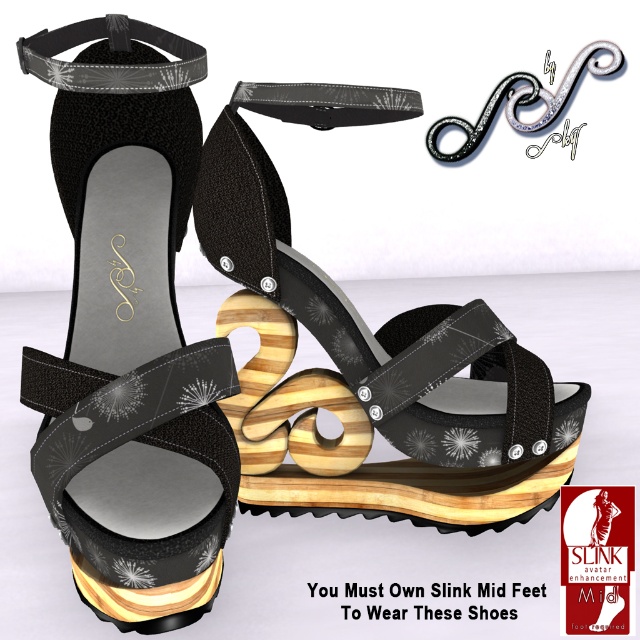
You are standing in a room with a wooden platform sandal at center. If you want to place a small vase exactly where the sandal is, where should you place it?

You should place the small vase at the position where the wooden platform sandal at center is located, which is at point (x=380, y=355).

You are standing 4 feet away from the point labeled point (56, 48). Can you safely step forward to touch it without overstepping?

The distance between you and point (56, 48) is 3.84 feet, so yes, you can safely step forward to touch it since you are already within the 4 feet distance.